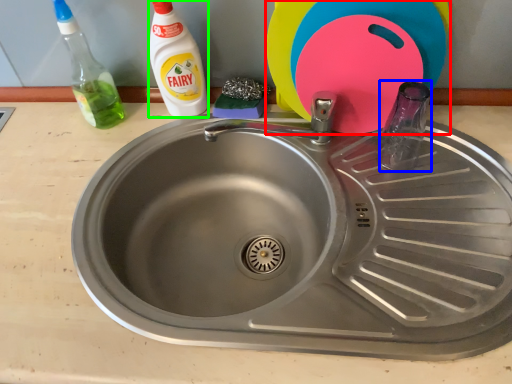
Question: Based on their relative distances, which object is farther from toy (highlighted by a red box)? Choose from bottle (highlighted by a blue box) and cleaning product (highlighted by a green box).

Choices:
 (A) bottle
 (B) cleaning product

Answer: (B)